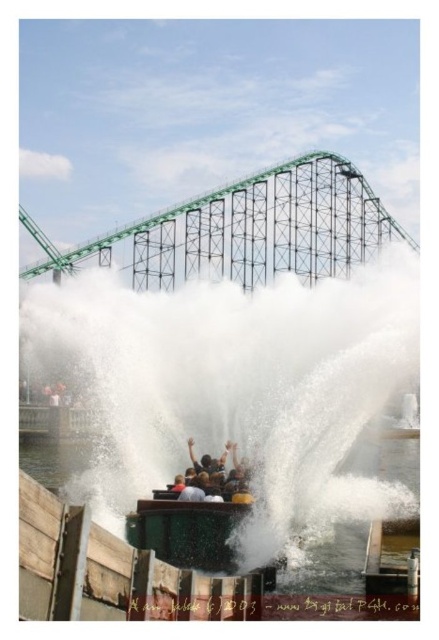
You are a ride engineer checking the safety of the roller coaster track structure. You have two critical points on the track, point [330,544] and point [207,474]. Which point is closer to the front of the roller coaster structure?

Point [330,544] is in front of point [207,474], so it is closer to the front of the roller coaster structure.